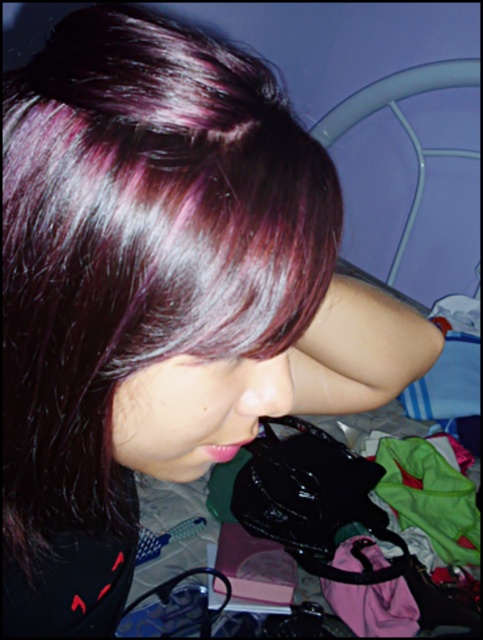
Can you confirm if green fabric at lower right is positioned above purple fabric at lower right?

Answer: Yes.

Is green fabric at lower right positioned at the back of purple fabric at lower right?

Yes, it is.

Between point (399, 445) and point (349, 616), which one is positioned in front?

Point (349, 616)

Find the location of a particular element. The image size is (483, 640). green fabric at lower right is located at coordinates [x=429, y=497].